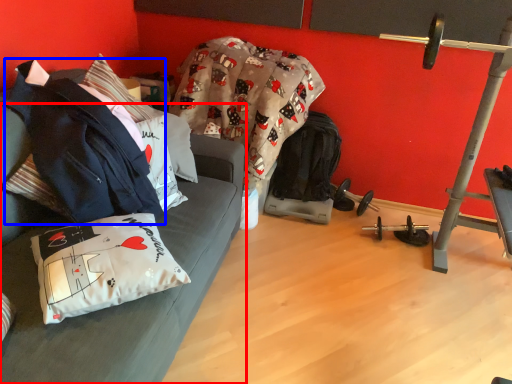
Question: Among these objects, which one is farthest to the camera, studio couch (highlighted by a red box) or jacket (highlighted by a blue box)?

Choices:
 (A) studio couch
 (B) jacket

Answer: (B)